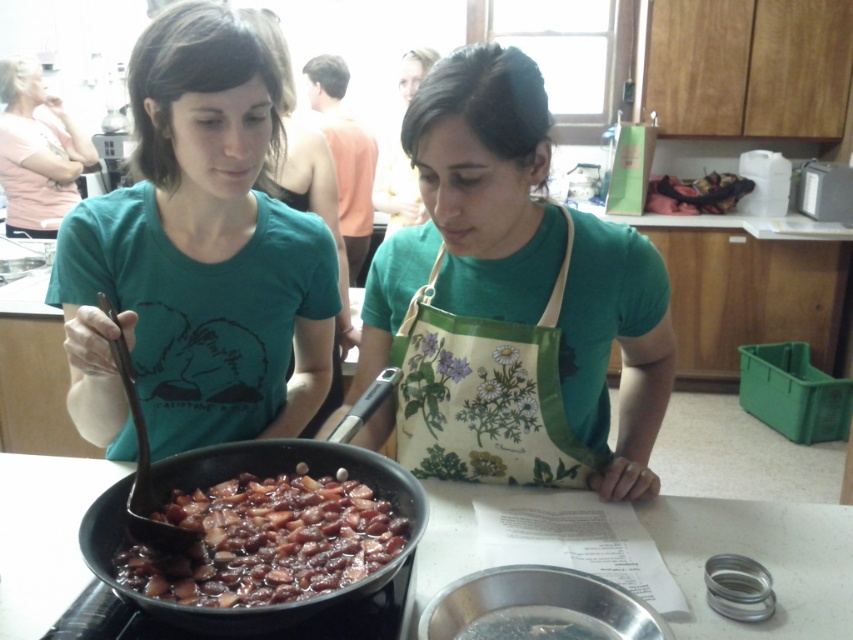
Consider the image. Is green fabric apron at center positioned in front of pink cotton shirt at upper left?

Yes, green fabric apron at center is closer to the viewer.

Which is behind, point (379, 358) or point (41, 168)?

The point (41, 168) is behind.

Locate an element on the screen. green fabric apron at center is located at coordinates (509, 301).

Can you confirm if green fabric apron at center is positioned below green matte t-shirt at center?

Yes.

Does green fabric apron at center come in front of green matte t-shirt at center?

No, green fabric apron at center is behind green matte t-shirt at center.

The height and width of the screenshot is (640, 853). I want to click on green fabric apron at center, so click(x=509, y=301).

Is green matte t-shirt at center shorter than pink cotton shirt at upper left?

Yes, green matte t-shirt at center is shorter than pink cotton shirt at upper left.

Is green matte t-shirt at center taller than pink cotton shirt at upper left?

No, green matte t-shirt at center is not taller than pink cotton shirt at upper left.

Image resolution: width=853 pixels, height=640 pixels. Describe the element at coordinates (196, 257) in the screenshot. I see `green matte t-shirt at center` at that location.

Locate an element on the screen. green matte t-shirt at center is located at coordinates (196, 257).